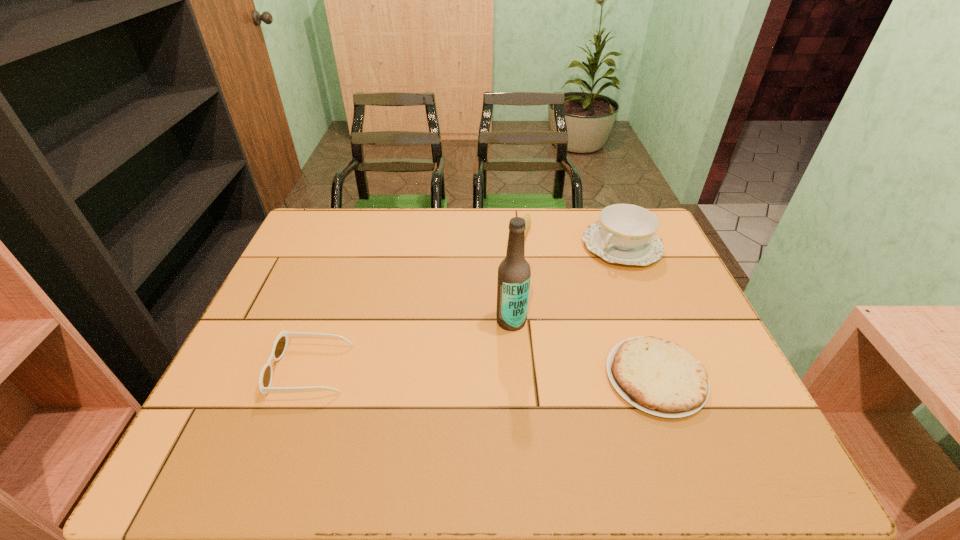
Locate an element on the screen. The width and height of the screenshot is (960, 540). blank region between the chinaware and the leftmost object is located at coordinates (467, 307).

Where is `free space between the shortest object and the third farthest object`? Image resolution: width=960 pixels, height=540 pixels. free space between the shortest object and the third farthest object is located at coordinates (584, 349).

Find the location of `object that can be found as the closest to the banana`. object that can be found as the closest to the banana is located at coordinates (626, 234).

Identify the location of the third closest object relative to the banana. (659, 377).

I want to click on vacant space that satisfies the following two spatial constraints: 1. on the front side of the tortilla; 2. on the right side of the banana, so click(539, 377).

This screenshot has width=960, height=540. What are the coordinates of `free spot that satisfies the following two spatial constraints: 1. on the back side of the banana; 2. on the left side of the third farthest object` in the screenshot? It's located at (505, 235).